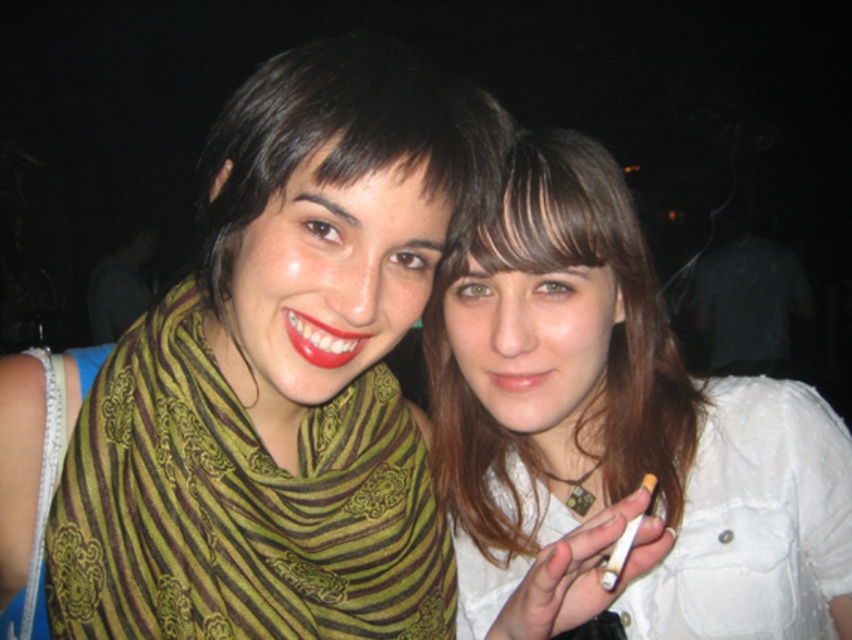
Is white textured shirt at center closer to camera compared to green striped scarf at left?

Yes, white textured shirt at center is in front of green striped scarf at left.

Between point (620, 244) and point (79, 531), which one is positioned in front?

Positioned in front is point (79, 531).

Locate an element on the screen. The height and width of the screenshot is (640, 852). white textured shirt at center is located at coordinates (620, 422).

Who is positioned more to the right, glossy red lipstick at center or matte pink lips at center?

From the viewer's perspective, matte pink lips at center appears more on the right side.

Is point (338, 349) farther from camera compared to point (532, 378)?

No.

The image size is (852, 640). Identify the location of glossy red lipstick at center. (321, 339).

The image size is (852, 640). Describe the element at coordinates (239, 506) in the screenshot. I see `green striped scarf at left` at that location.

Where is `green striped scarf at left`? The image size is (852, 640). green striped scarf at left is located at coordinates (239, 506).